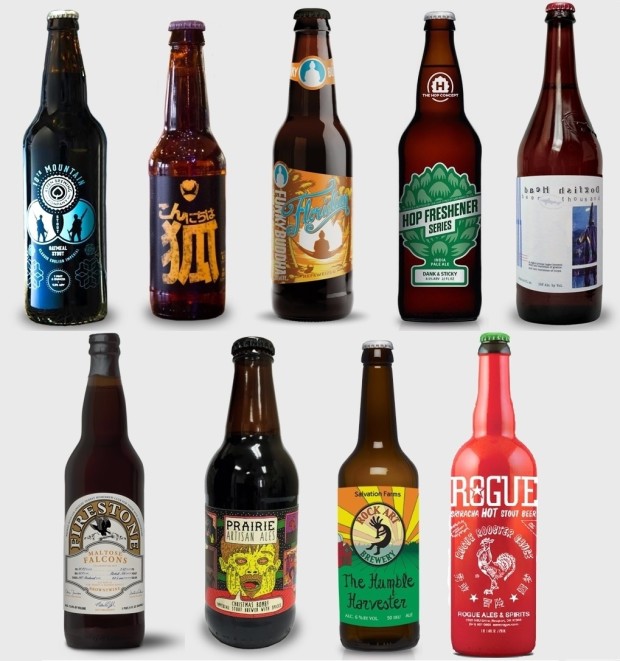
Locate an element on the screen. beer bottle shadow is located at coordinates (159, 642), (302, 630), (604, 317), (360, 317), (113, 318), (228, 315).